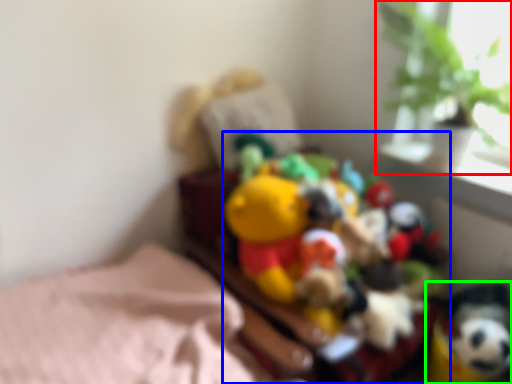
Question: Which is farther away from houseplant (highlighted by a red box)? toy (highlighted by a blue box) or toy (highlighted by a green box)?

Choices:
 (A) toy
 (B) toy

Answer: (B)